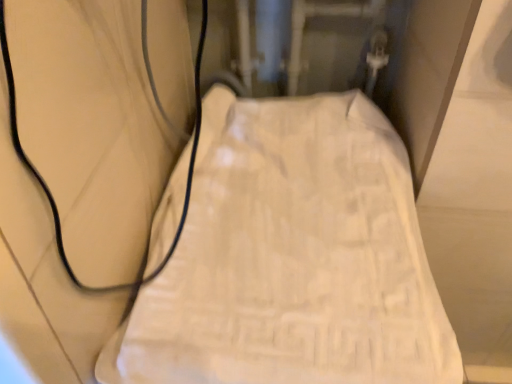
Locate an element on the screen. vacant region above white textured towel at center (from a real-world perspective) is located at coordinates click(x=306, y=213).